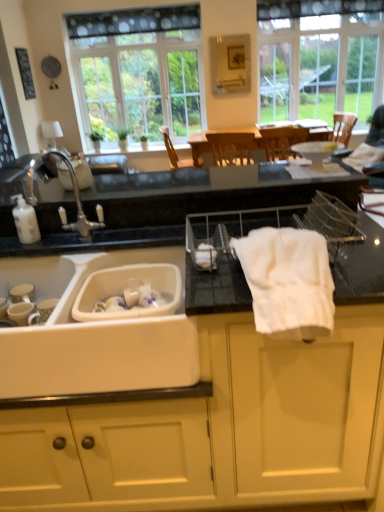
Question: Does wooden chair at center appear on the right side of white matte cabinet at center?

Choices:
 (A) yes
 (B) no

Answer: (A)

Question: Is white matte cabinet at center surrounded by wooden chair at center?

Choices:
 (A) no
 (B) yes

Answer: (A)

Question: Are wooden chair at center and white matte cabinet at center far apart?

Choices:
 (A) no
 (B) yes

Answer: (B)

Question: From the image's perspective, would you say wooden chair at center is shown under white matte cabinet at center?

Choices:
 (A) yes
 (B) no

Answer: (B)

Question: Is wooden chair at center in front of white matte cabinet at center?

Choices:
 (A) yes
 (B) no

Answer: (B)

Question: Does wooden chair at center turn towards white matte cabinet at center?

Choices:
 (A) no
 (B) yes

Answer: (A)

Question: Are white cotton bath towel at center and white plastic sink at lower left beside each other?

Choices:
 (A) yes
 (B) no

Answer: (B)

Question: From a real-world perspective, is white cotton bath towel at center physically below white plastic sink at lower left?

Choices:
 (A) yes
 (B) no

Answer: (B)

Question: Is white cotton bath towel at center positioned before white plastic sink at lower left?

Choices:
 (A) yes
 (B) no

Answer: (A)

Question: Does white cotton bath towel at center have a smaller size compared to white plastic sink at lower left?

Choices:
 (A) yes
 (B) no

Answer: (A)

Question: Is white cotton bath towel at center further to the viewer compared to white plastic sink at lower left?

Choices:
 (A) no
 (B) yes

Answer: (A)

Question: Considering the relative positions of white cotton bath towel at center and white plastic sink at lower left in the image provided, is white cotton bath towel at center to the left of white plastic sink at lower left from the viewer's perspective?

Choices:
 (A) yes
 (B) no

Answer: (B)

Question: Is clear glass window at upper right, the 2th window viewed from the left, facing towards white plastic sink at lower left?

Choices:
 (A) yes
 (B) no

Answer: (A)